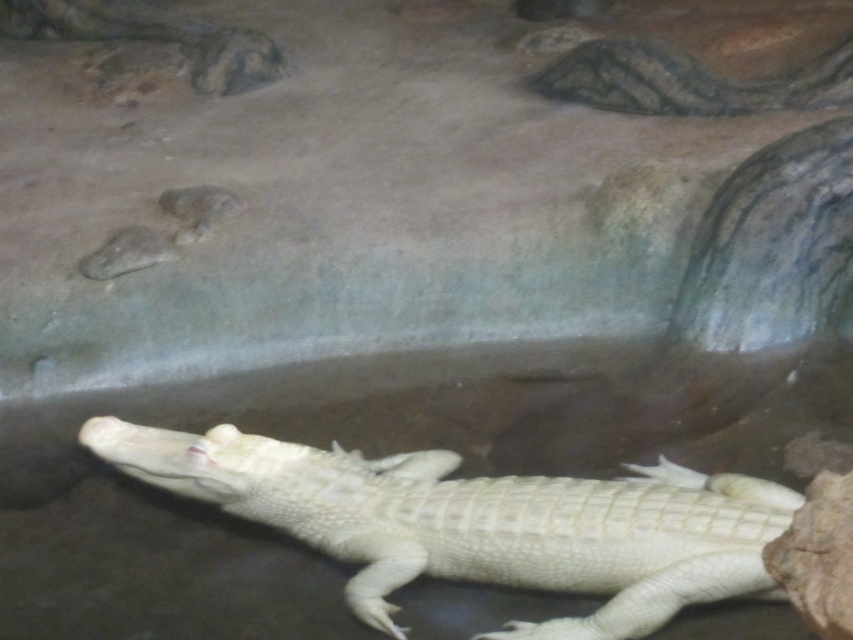
Question: Which point is closer to the camera taking this photo?

Choices:
 (A) (392, 512)
 (B) (848, 74)

Answer: (A)

Question: Is smooth white crocodile at center thinner than smooth greenish-brown crocodile at upper right?

Choices:
 (A) yes
 (B) no

Answer: (B)

Question: Does smooth white crocodile at center appear over smooth greenish-brown crocodile at upper right?

Choices:
 (A) no
 (B) yes

Answer: (A)

Question: Is smooth white crocodile at center closer to the viewer compared to smooth greenish-brown crocodile at upper right?

Choices:
 (A) no
 (B) yes

Answer: (B)

Question: Which point appears closest to the camera in this image?

Choices:
 (A) (390, 458)
 (B) (723, 106)

Answer: (A)